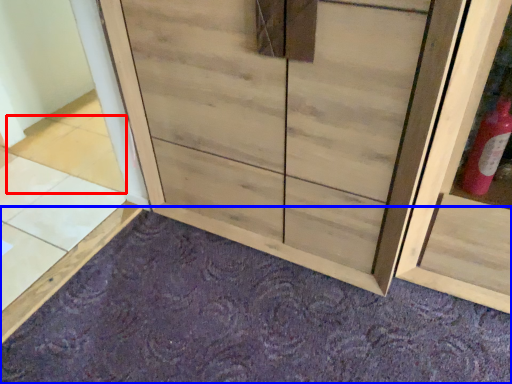
Question: Which point is further to the camera, tile (highlighted by a red box) or plain (highlighted by a blue box)?

Choices:
 (A) tile
 (B) plain

Answer: (A)